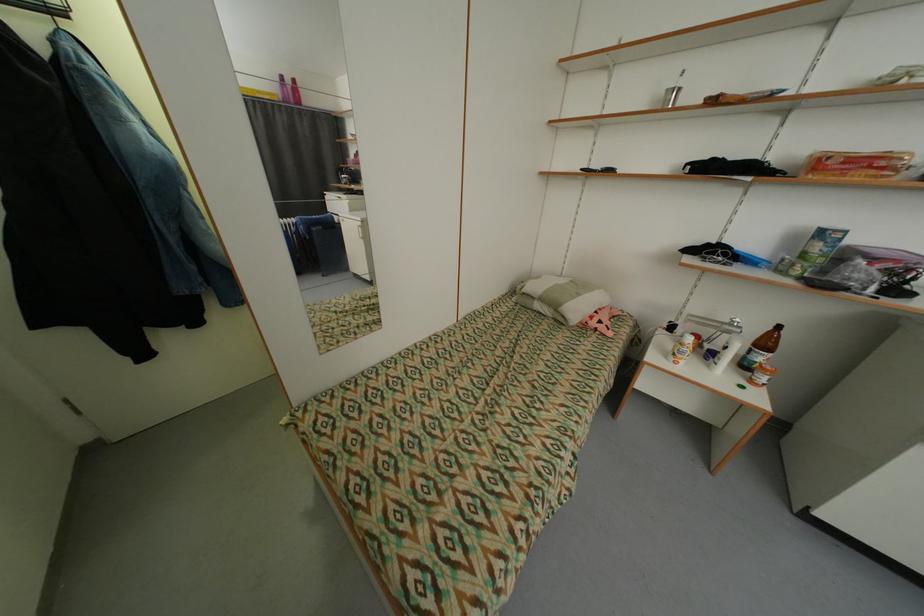
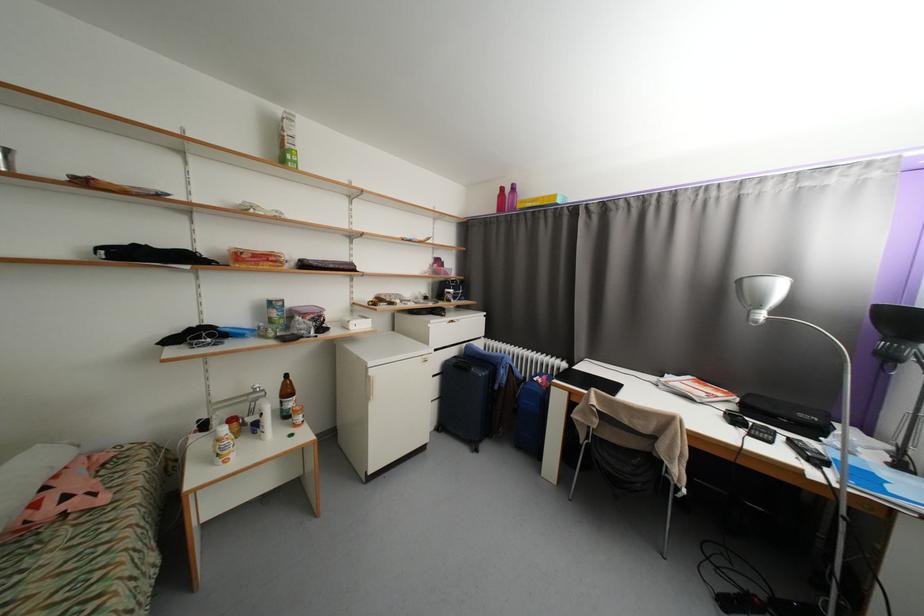
The point at (714, 367) is marked in the first image. Where is the corresponding point in the second image?

(265, 439)